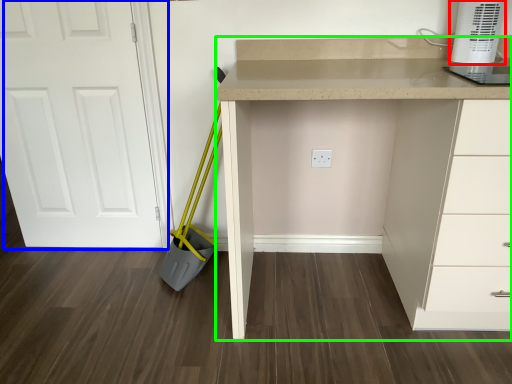
Question: Which object is positioned farthest from home appliance (highlighted by a red box)? Select from door (highlighted by a blue box) and computer desk (highlighted by a green box).

Choices:
 (A) door
 (B) computer desk

Answer: (A)